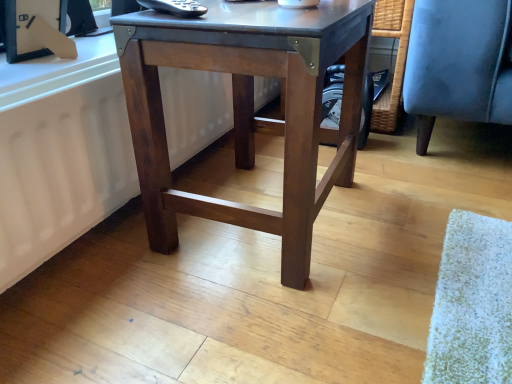
Image resolution: width=512 pixels, height=384 pixels. I want to click on free spot in front of dark brown wood table at center, so click(265, 316).